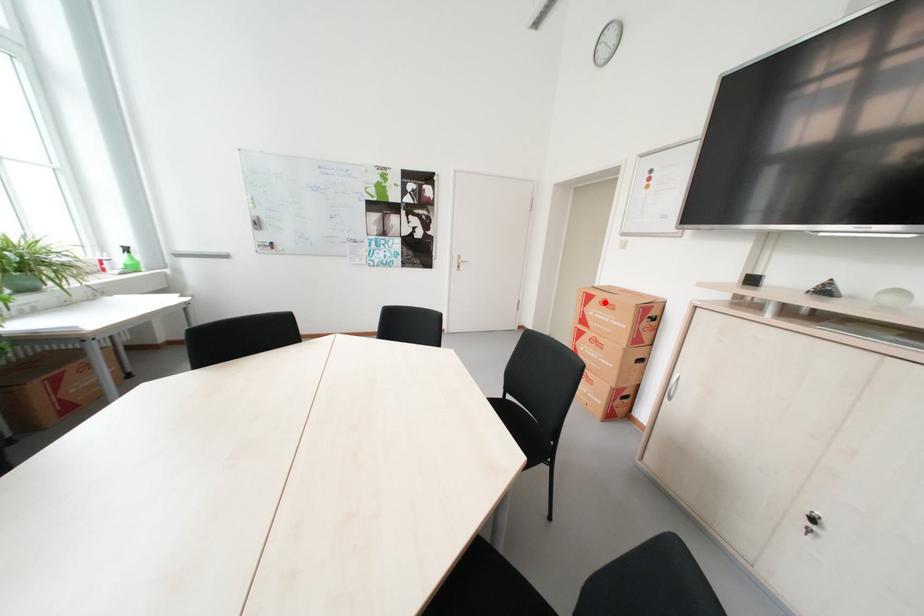
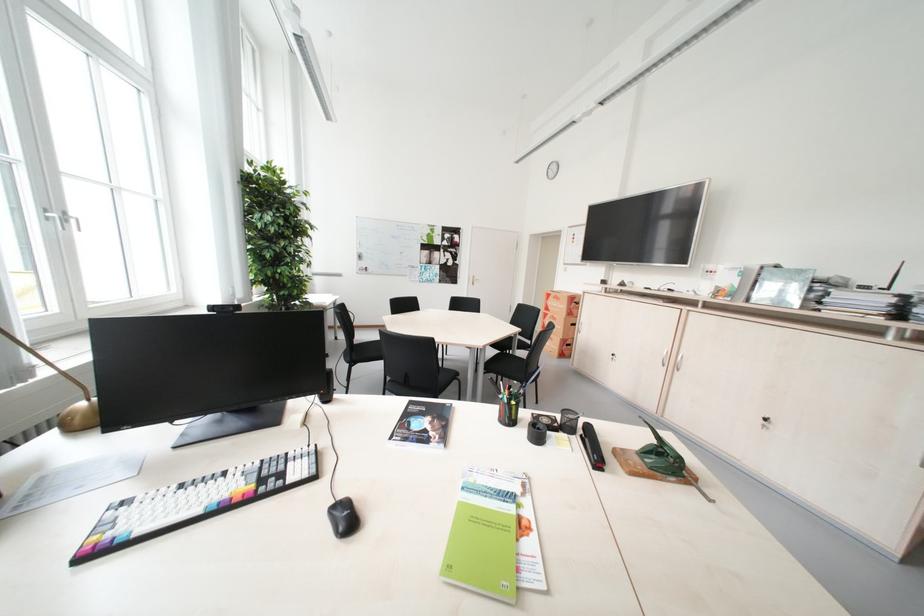
The point at the highlighted location is marked in the first image. Where is the corresponding point in the second image?

(561, 299)